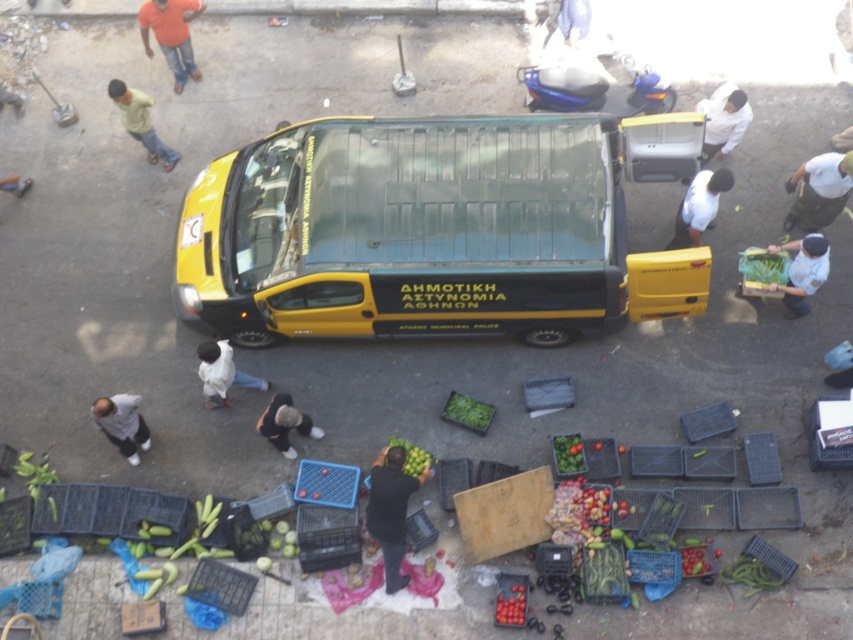
Between point (392, 532) and point (468, 417), which one is positioned behind?

Point (468, 417)

Is dark blue jeans at center bigger than green leafy vegetables at center?

Correct, dark blue jeans at center is larger in size than green leafy vegetables at center.

Does point (402, 458) come farther from viewer compared to point (467, 413)?

No, it is not.

You are a GUI agent. You are given a task and a screenshot of the screen. Output one action in this format:
    pyautogui.click(x=<x>, y=<y>)
    Task: Click on the dark blue jeans at center
    The width and height of the screenshot is (853, 640).
    Given the screenshot: What is the action you would take?
    pyautogui.click(x=392, y=509)

Is point (788, 275) positioned after point (746, 579)?

Yes, it is.

Is white uniform at center in front of green matte cucumber at lower right?

No, white uniform at center is behind green matte cucumber at lower right.

What do you see at coordinates (802, 272) in the screenshot? I see `white uniform at center` at bounding box center [802, 272].

At what (x,y) coordinates should I click in order to perform the action: click on white uniform at center. Please return your answer as a coordinate pair (x, y). Looking at the image, I should click on (802, 272).

Does light green cotton shirt at left have a lesser width compared to green matte cucumber at lower left?

In fact, light green cotton shirt at left might be wider than green matte cucumber at lower left.

From the picture: Does light green cotton shirt at left have a greater width compared to green matte cucumber at lower left?

Yes, light green cotton shirt at left is wider than green matte cucumber at lower left.

The width and height of the screenshot is (853, 640). I want to click on light green cotton shirt at left, so click(x=140, y=122).

What are the coordinates of `light green cotton shirt at left` in the screenshot? It's located at (140, 122).